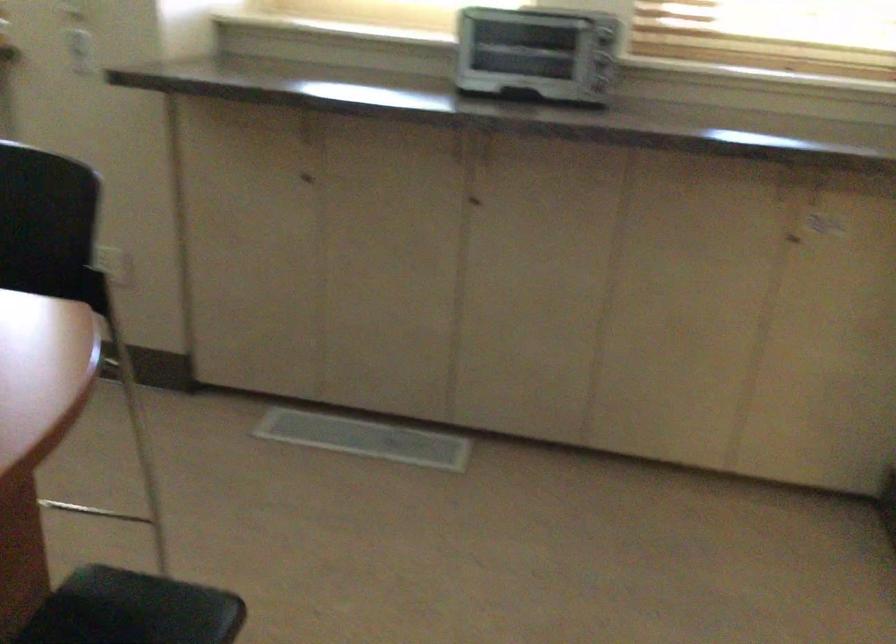
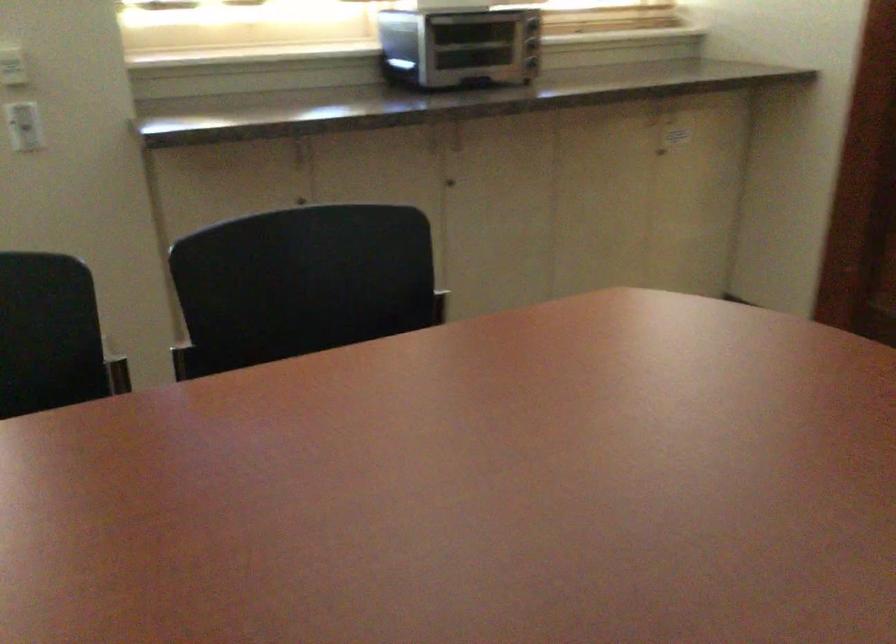
Locate, in the second image, the point that corresponds to (x=595, y=71) in the first image.

(531, 44)